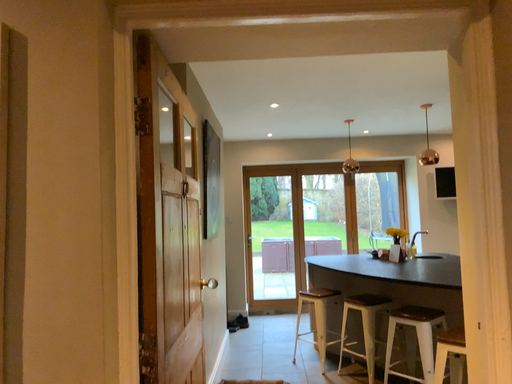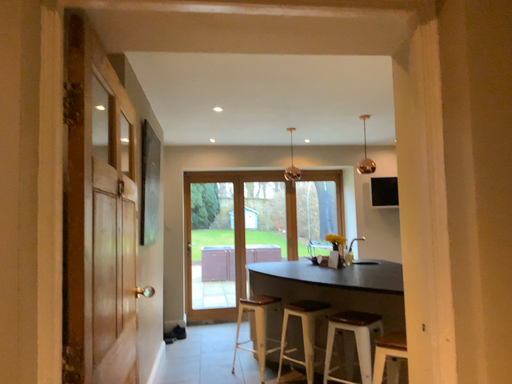
Question: Which way did the camera rotate in the video?

Choices:
 (A) rotated left
 (B) rotated right

Answer: (B)